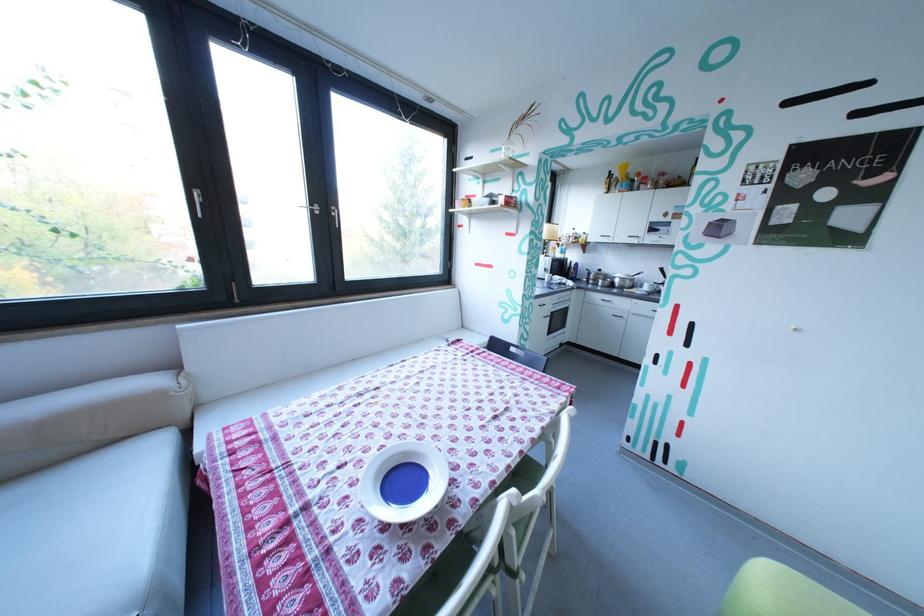
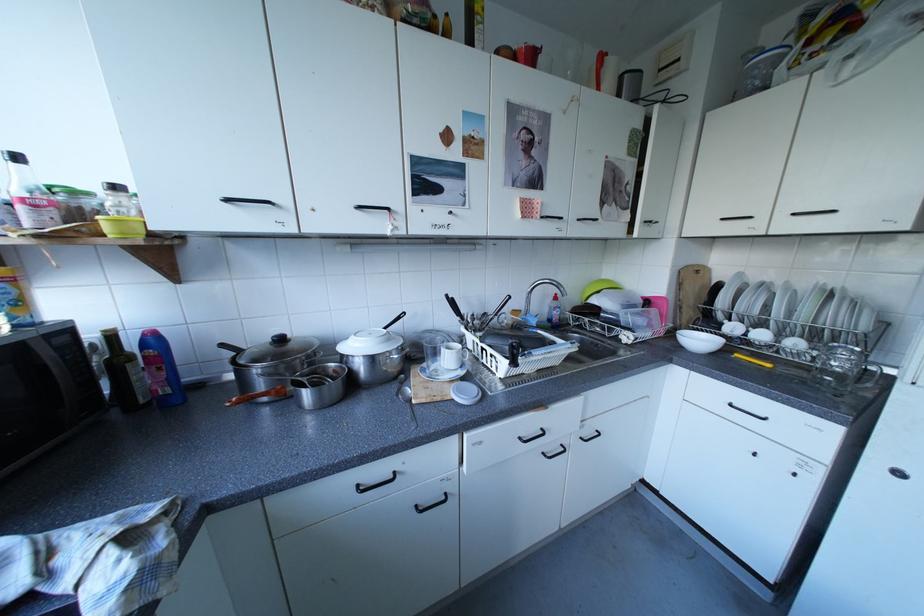
The point at (590, 265) is marked in the first image. Where is the corresponding point in the second image?

(165, 339)